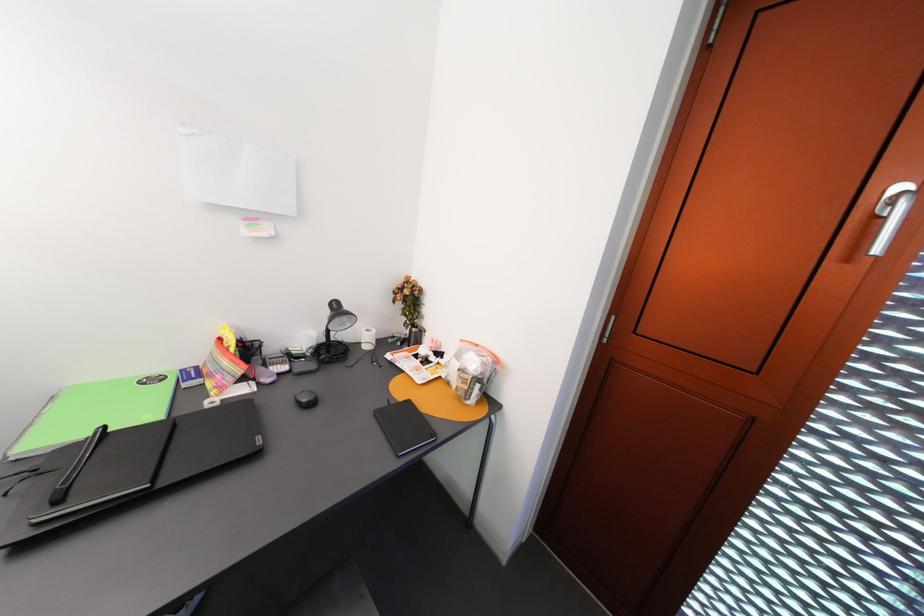
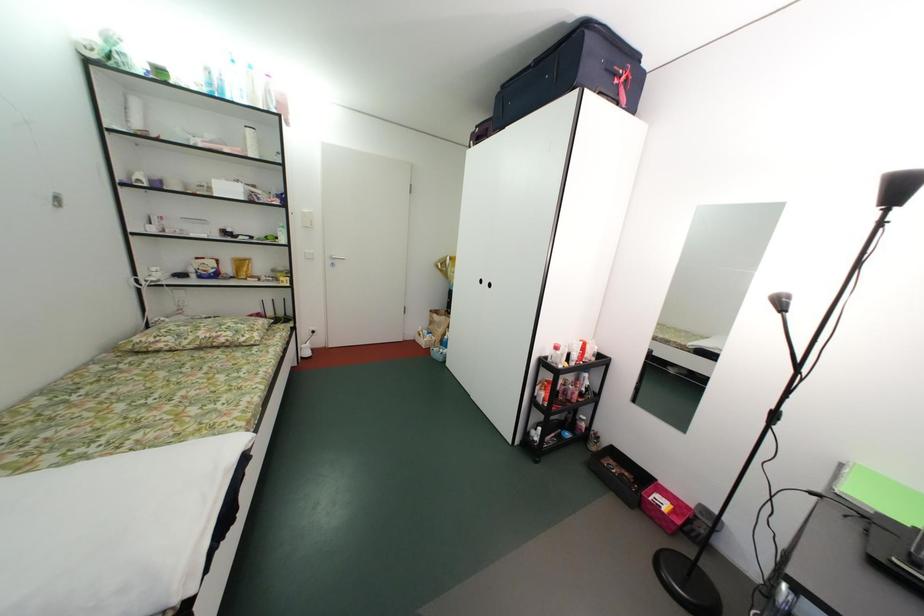
Question: The first image is from the beginning of the video and the second image is from the end. How did the camera likely rotate when shooting the video?

Choices:
 (A) Left
 (B) Right
 (C) Up
 (D) Down

Answer: (A)